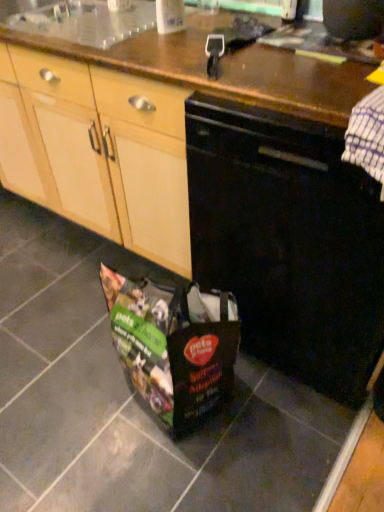
Question: From a real-world perspective, is black matte dishwasher at center located higher than white glossy container at upper center?

Choices:
 (A) no
 (B) yes

Answer: (A)

Question: From the image's perspective, is black matte dishwasher at center located beneath white glossy container at upper center?

Choices:
 (A) no
 (B) yes

Answer: (B)

Question: Is white glossy container at upper center inside black matte dishwasher at center?

Choices:
 (A) yes
 (B) no

Answer: (B)

Question: Is black matte dishwasher at center shorter than white glossy container at upper center?

Choices:
 (A) no
 (B) yes

Answer: (A)

Question: Is black matte dishwasher at center to the left of white glossy container at upper center from the viewer's perspective?

Choices:
 (A) no
 (B) yes

Answer: (A)

Question: Is black matte dishwasher at center oriented towards white glossy container at upper center?

Choices:
 (A) no
 (B) yes

Answer: (A)

Question: From a real-world perspective, is white glossy container at upper center under black matte dishwasher at center?

Choices:
 (A) no
 (B) yes

Answer: (A)

Question: Can you confirm if white glossy container at upper center is taller than black matte dishwasher at center?

Choices:
 (A) no
 (B) yes

Answer: (A)

Question: Considering the relative positions of white glossy container at upper center and black matte dishwasher at center in the image provided, is white glossy container at upper center to the left of black matte dishwasher at center from the viewer's perspective?

Choices:
 (A) yes
 (B) no

Answer: (A)

Question: Is white glossy container at upper center looking in the opposite direction of black matte dishwasher at center?

Choices:
 (A) no
 (B) yes

Answer: (A)

Question: Is white glossy container at upper center positioned beyond the bounds of black matte dishwasher at center?

Choices:
 (A) no
 (B) yes

Answer: (B)

Question: From the image's perspective, is white glossy container at upper center on top of black matte dishwasher at center?

Choices:
 (A) yes
 (B) no

Answer: (A)

Question: Considering their positions, is white glossy container at upper center located in front of or behind black matte dishwasher at center?

Choices:
 (A) behind
 (B) front

Answer: (A)